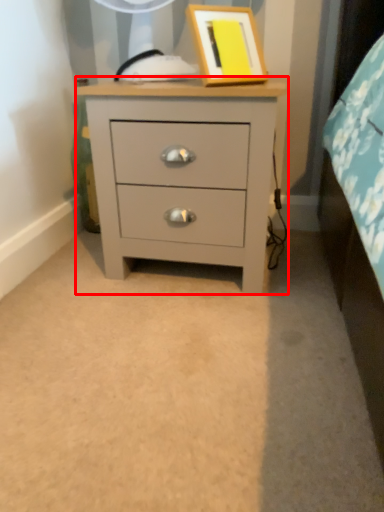
Question: Observing the image, what is the correct spatial positioning of chest of drawers (annotated by the red box) in reference to picture frame?

Choices:
 (A) left
 (B) right

Answer: (A)